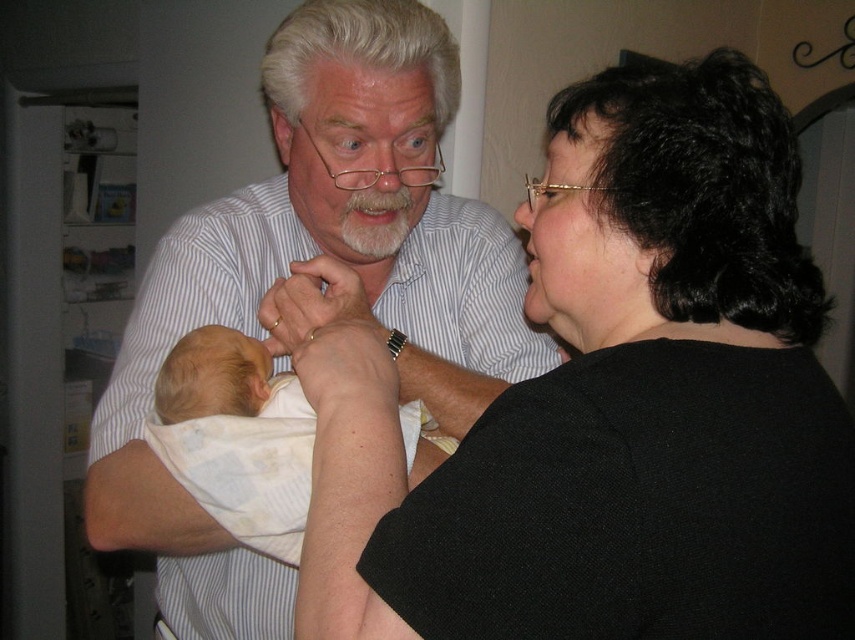
Who is higher up, black fabric shirt at upper right or soft white swaddle at center?

Positioned higher is black fabric shirt at upper right.

Is point (513, 420) positioned before point (302, 486)?

Yes, it is in front of point (302, 486).

Locate an element on the screen. black fabric shirt at upper right is located at coordinates (606, 403).

Does black fabric shirt at upper right have a smaller size compared to white striped shirt at upper left?

Indeed, black fabric shirt at upper right has a smaller size compared to white striped shirt at upper left.

Looking at this image, who is more forward, (780, 140) or (199, 323)?

Point (780, 140) is in front.

The height and width of the screenshot is (640, 855). Find the location of `black fabric shirt at upper right`. black fabric shirt at upper right is located at coordinates (606, 403).

Is white striped shirt at upper left above soft white swaddle at center?

Yes.

Is white striped shirt at upper left positioned at the back of soft white swaddle at center?

Yes, white striped shirt at upper left is behind soft white swaddle at center.

Image resolution: width=855 pixels, height=640 pixels. Describe the element at coordinates (287, 273) in the screenshot. I see `white striped shirt at upper left` at that location.

Where is `white striped shirt at upper left`? white striped shirt at upper left is located at coordinates (287, 273).